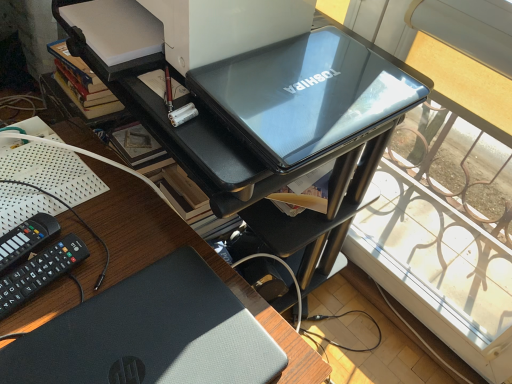
Question: From the image's perspective, is glossy black laptop at upper center above or below slate gray matte laptop at lower left?

Choices:
 (A) below
 (B) above

Answer: (B)

Question: Is glossy black laptop at upper center wider or thinner than slate gray matte laptop at lower left?

Choices:
 (A) wide
 (B) thin

Answer: (A)

Question: Which object is the farthest from the glossy white printer at upper center?

Choices:
 (A) glossy black laptop at upper center
 (B) black plastic remote control at lower left, the second equipment positioned from the right
 (C) slate gray matte laptop at lower left
 (D) black plastic remote control at lower left, which ranks as the second equipment in left-to-right order

Answer: (D)

Question: Which object is the farthest from the glossy white printer at upper center?

Choices:
 (A) black plastic remote control at lower left, the second equipment positioned from the right
 (B) slate gray matte laptop at lower left
 (C) black plastic remote control at lower left, which ranks as the second equipment in left-to-right order
 (D) glossy black laptop at upper center

Answer: (C)